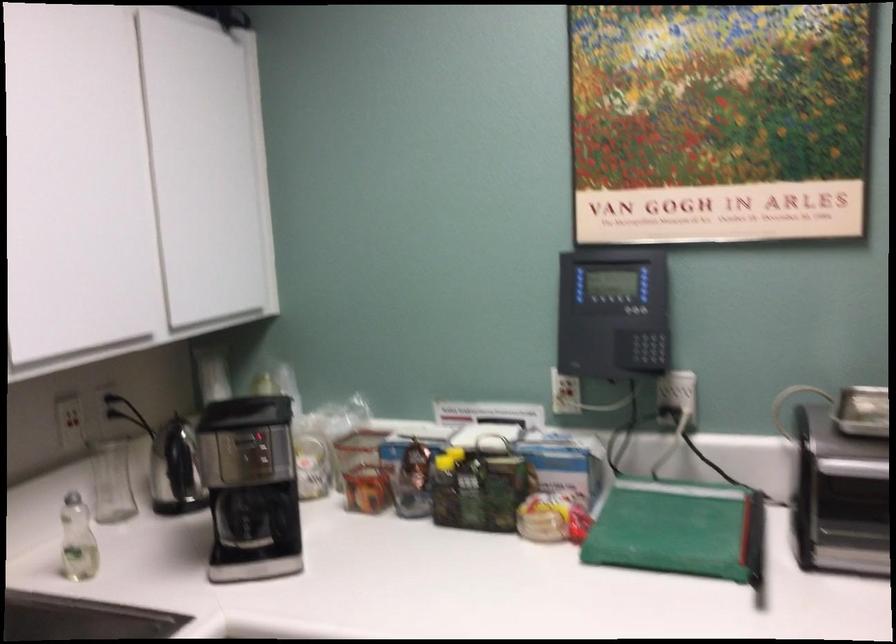
Find the location of a particular element. kettle handle is located at coordinates (177, 466).